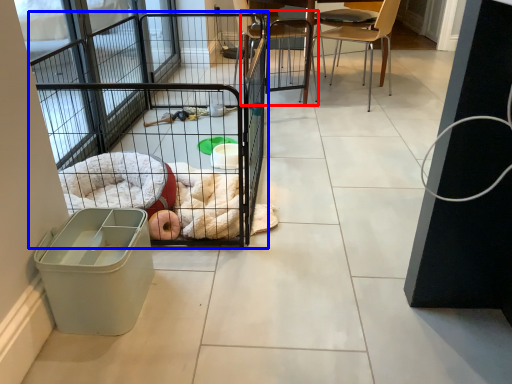
Question: Which object is further to the camera taking this photo, chair (highlighted by a red box) or cage (highlighted by a blue box)?

Choices:
 (A) chair
 (B) cage

Answer: (A)